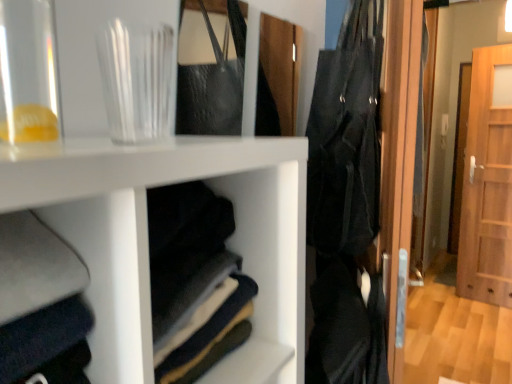
Image resolution: width=512 pixels, height=384 pixels. Find the location of `free point in front of wooden door at right`. free point in front of wooden door at right is located at coordinates (489, 314).